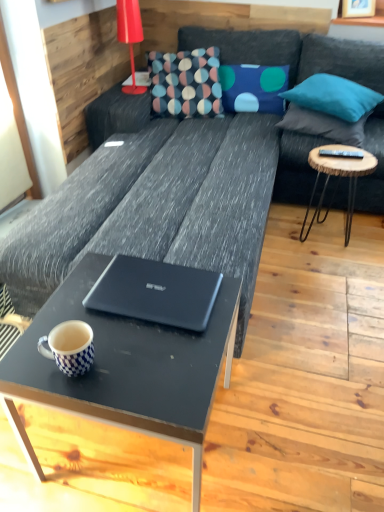
Where is `free space to the left of white checkered mug at lower left`? free space to the left of white checkered mug at lower left is located at coordinates (32, 356).